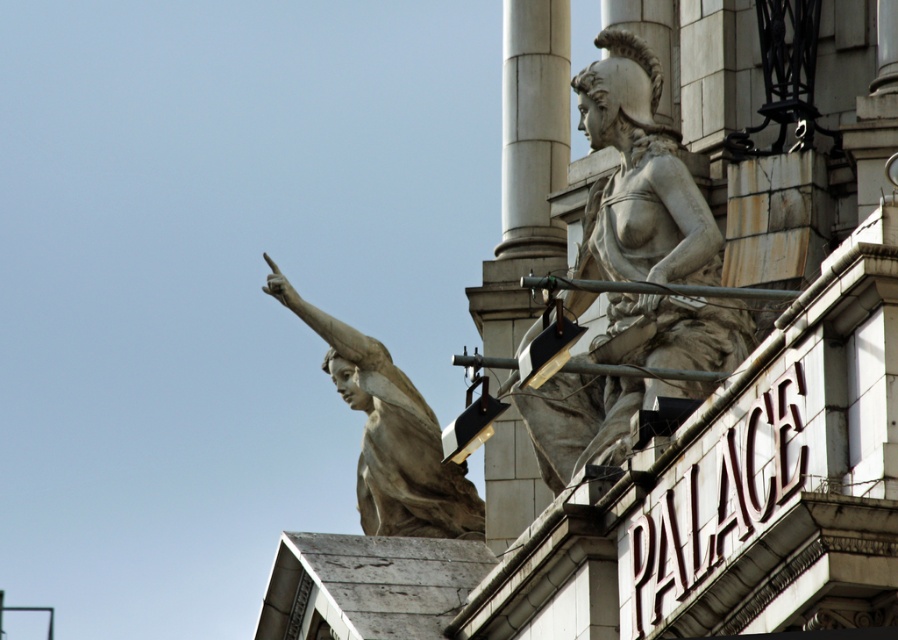
You are an architect examining the building facade. You need to determine the relative positions of the white stone pillar at upper right and the matte stone statue at upper left. Which object is positioned to the right of the other?

The white stone pillar at upper right is positioned to the right of the matte stone statue at upper left.

Looking at this image, you are standing in front of the building and notice two points marked on the facade. The first point is at coordinates point [497,509] and the second is at point [416,445]. Which of these points is nearer to your current position?

Point [497,509] is closer to the camera than point [416,445], so the first point is nearer to your current position.

You are an architect inspecting the building facade. You notice the stone statue at upper right and the matte stone statue at upper left. Which statue has a larger size?

The stone statue at upper right is bigger than the matte stone statue at upper left, so the statue at upper right is larger in size.